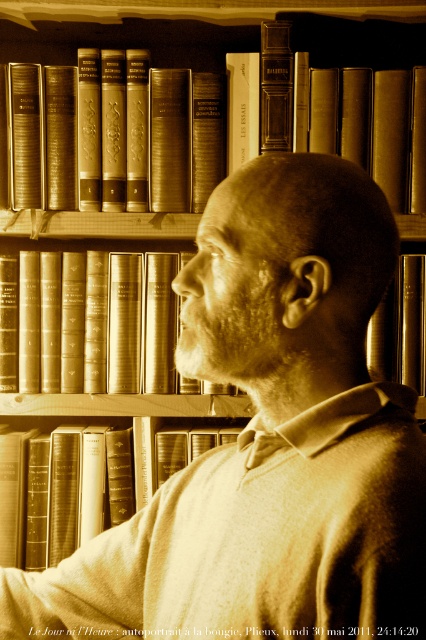
You are organizing books on a shelf and need to place the sepia leather book at center and the hardcover book at upper center. Which book should you place first if you want to arrange them from thinnest to thickest?

You should place the sepia leather book at center first because it is thinner than the hardcover book at upper center, so arranging them from thinnest to thickest would start with the thinner book.

You are a librarian who needs to retrieve the sepia leather book at center from the bookshelf. Given that you can comfortably reach up to 1.6 meters, can you reach it without using a ladder?

The sepia leather book at center is 1.38 meters away from the viewer, so yes, you can reach it without a ladder since it is within your 1.6 meters reach.

You are organizing a library and need to place the sepia leather book at center and the hardcover book at center on a shelf. Given their sizes, which book should you place first to ensure they both fit properly?

Since the sepia leather book at center occupies less space than the hardcover book at center, you should place the hardcover book at center first to accommodate its larger size, then fit the smaller sepia leather book at center next to it.